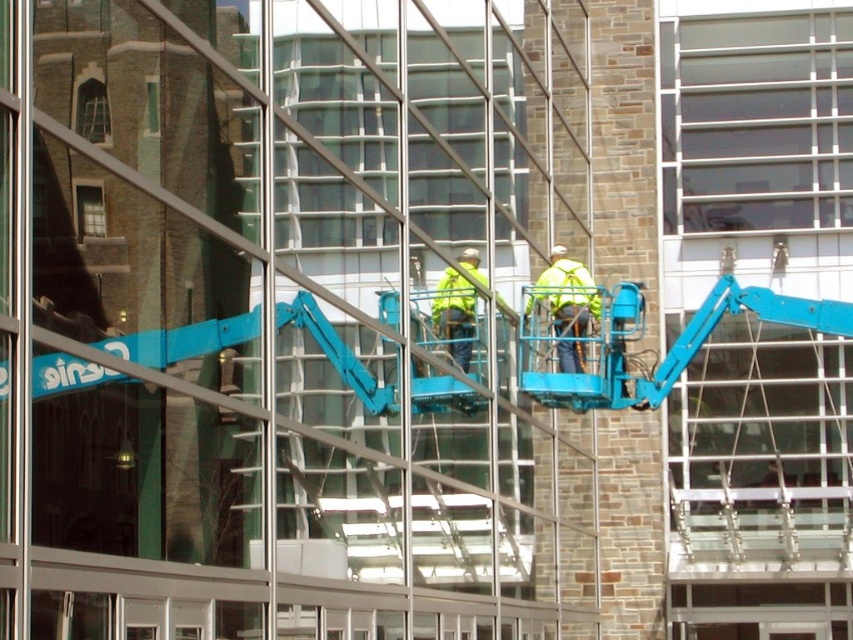
Question: Can you confirm if clear glass window at upper center is positioned above high-visibility yellow-green fabric safety vest at center-right?

Choices:
 (A) yes
 (B) no

Answer: (A)

Question: Which object is positioned farthest from the clear glass window at upper center?

Choices:
 (A) matte glass window at upper left
 (B) high-visibility yellow-green fabric safety vest at center-right
 (C) brown stone window at upper left
 (D) yellow reflective safety vest at center

Answer: (A)

Question: Which of these objects is positioned farthest from the high-visibility yellow-green fabric safety vest at center-right?

Choices:
 (A) yellow reflective safety vest at center
 (B) brown stone window at upper left

Answer: (B)

Question: Does yellow reflective safety vest at center have a lesser width compared to clear glass window at upper left?

Choices:
 (A) yes
 (B) no

Answer: (B)

Question: Is brown stone window at upper left to the right of yellow reflective safety vest at center from the viewer's perspective?

Choices:
 (A) no
 (B) yes

Answer: (A)

Question: Which of the following is the closest to the observer?

Choices:
 (A) clear glass window at upper center
 (B) brown stone window at upper left
 (C) clear glass window at upper left

Answer: (B)